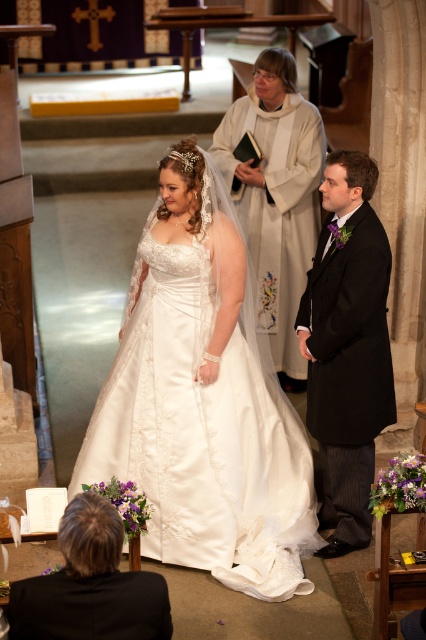
You are a photographer at the wedding ceremony. You need to capture a photo where both the matte black suit at right and the satin dress at center are clearly visible. Considering their sizes, which one might appear smaller in the photo?

The matte black suit at right has a smaller size compared to the satin dress at center, so it will appear smaller in the photo.